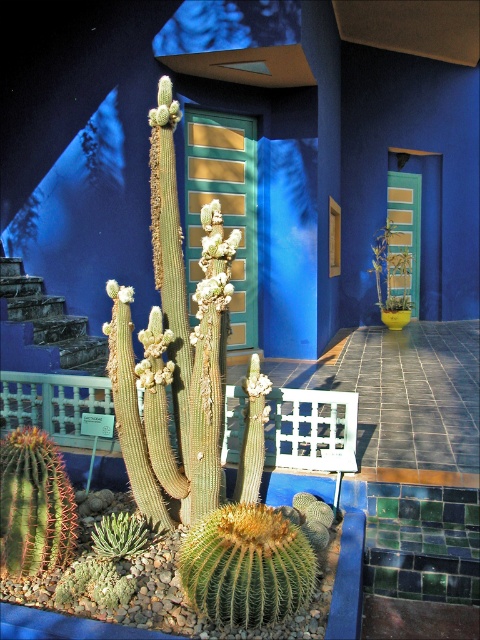
Which of these two, green leafy plant at center or green fuzzy cactus at lower left, stands shorter?

Standing shorter between the two is green fuzzy cactus at lower left.

Is green leafy plant at center positioned at the back of green fuzzy cactus at lower left?

That is True.

Does point (387, 296) come behind point (96, 564)?

Yes.

The image size is (480, 640). Find the location of `green leafy plant at center`. green leafy plant at center is located at coordinates (393, 269).

From the picture: Between green spiky cactus at lower center and green fuzzy cactus at lower left, which one has less height?

Standing shorter between the two is green fuzzy cactus at lower left.

Is point (214, 561) behind point (60, 579)?

No, (214, 561) is in front of (60, 579).

I want to click on green spiky cactus at lower center, so click(247, 564).

Which of these two, succulent spiny at center or green succulent at lower left, stands taller?

succulent spiny at center

Measure the distance between point (123,410) and camera.

They are 3.60 meters apart.

Does point (205, 474) lie behind point (121, 532)?

No.

This screenshot has height=640, width=480. What are the coordinates of `succulent spiny at center` in the screenshot? It's located at (168, 355).